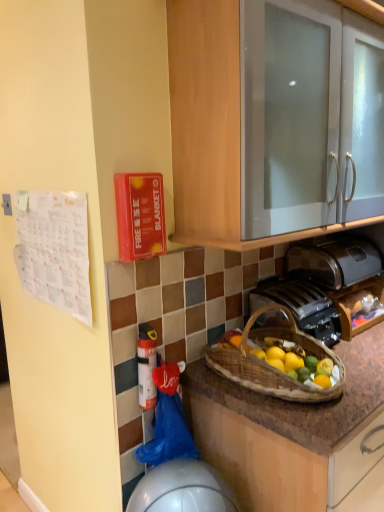
Question: Can you confirm if brown woven picnic basket at lower center is shorter than metallic silver toaster at lower center?

Choices:
 (A) no
 (B) yes

Answer: (A)

Question: Can metallic silver toaster at lower center be found inside brown woven picnic basket at lower center?

Choices:
 (A) yes
 (B) no

Answer: (B)

Question: Does brown woven picnic basket at lower center have a smaller size compared to metallic silver toaster at lower center?

Choices:
 (A) yes
 (B) no

Answer: (B)

Question: Is brown woven picnic basket at lower center positioned in front of metallic silver toaster at lower center?

Choices:
 (A) yes
 (B) no

Answer: (A)

Question: Is the depth of brown woven picnic basket at lower center greater than that of metallic silver toaster at lower center?

Choices:
 (A) yes
 (B) no

Answer: (B)

Question: Considering the positions of point (256, 314) and point (249, 245), is point (256, 314) closer or farther from the camera than point (249, 245)?

Choices:
 (A) closer
 (B) farther

Answer: (B)

Question: From a real-world perspective, is brown woven picnic basket at lower center positioned above or below white glossy cabinet at upper center?

Choices:
 (A) below
 (B) above

Answer: (A)

Question: From the image's perspective, relative to white glossy cabinet at upper center, is brown woven picnic basket at lower center above or below?

Choices:
 (A) below
 (B) above

Answer: (A)

Question: Considering the positions of brown woven picnic basket at lower center and white glossy cabinet at upper center in the image, is brown woven picnic basket at lower center bigger or smaller than white glossy cabinet at upper center?

Choices:
 (A) big
 (B) small

Answer: (B)

Question: Is white glossy cabinet at upper center bigger or smaller than white plastic extinguisher at lower center?

Choices:
 (A) big
 (B) small

Answer: (A)

Question: Is white glossy cabinet at upper center spatially inside white plastic extinguisher at lower center, or outside of it?

Choices:
 (A) inside
 (B) outside

Answer: (B)

Question: Is white glossy cabinet at upper center wider or thinner than white plastic extinguisher at lower center?

Choices:
 (A) thin
 (B) wide

Answer: (B)

Question: Considering their positions, is white glossy cabinet at upper center located in front of or behind white plastic extinguisher at lower center?

Choices:
 (A) front
 (B) behind

Answer: (A)

Question: From the image's perspective, relative to white glossy cabinet at upper center, is metallic silver toaster at lower center above or below?

Choices:
 (A) above
 (B) below

Answer: (B)

Question: Looking at their shapes, would you say metallic silver toaster at lower center is wider or thinner than white glossy cabinet at upper center?

Choices:
 (A) wide
 (B) thin

Answer: (B)